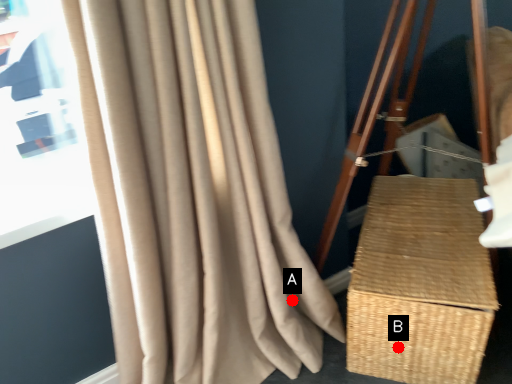
Question: Two points are circled on the image, labeled by A and B beside each circle. Which point is closer to the camera?

Choices:
 (A) A is closer
 (B) B is closer

Answer: (B)